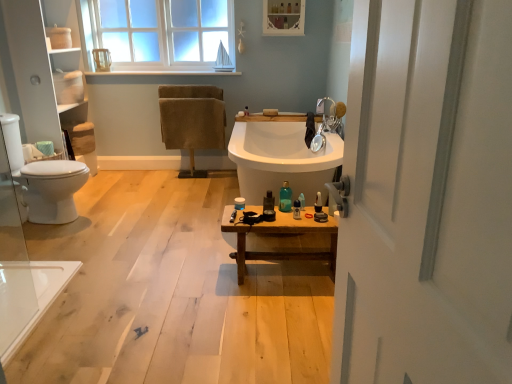
Locate an element on the screen. The height and width of the screenshot is (384, 512). free space above wooden bench at center (from a real-world perspective) is located at coordinates (286, 211).